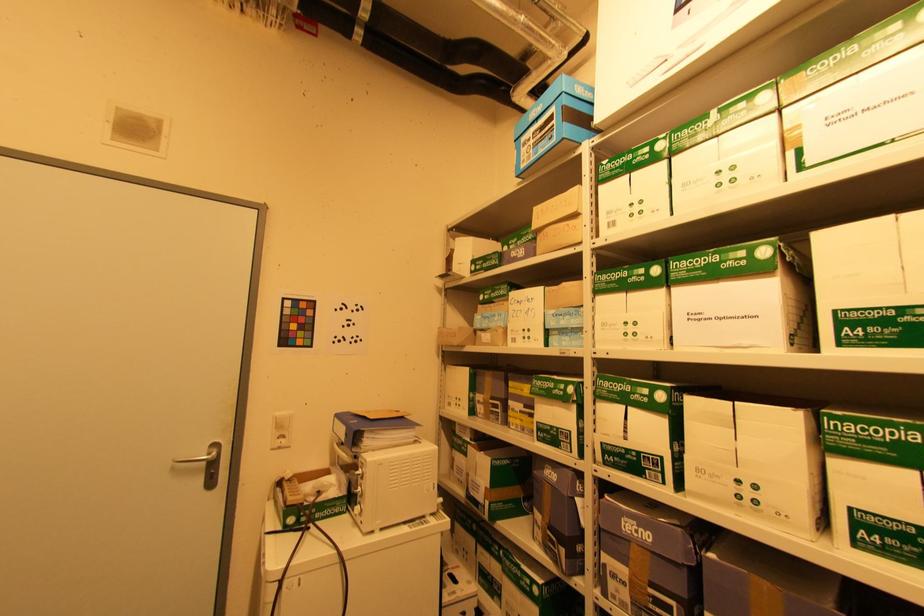
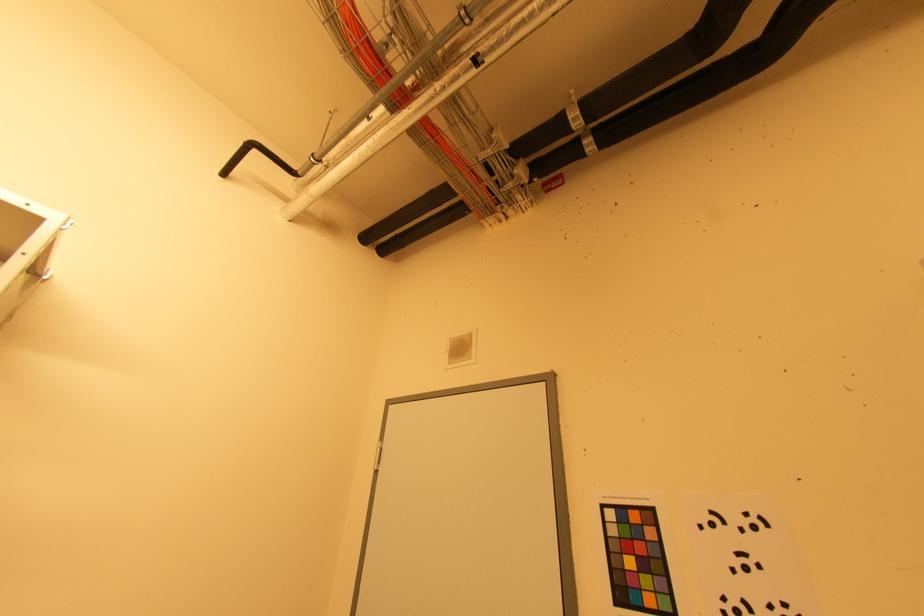
How did the camera likely rotate?

The camera's rotation is toward left-up.